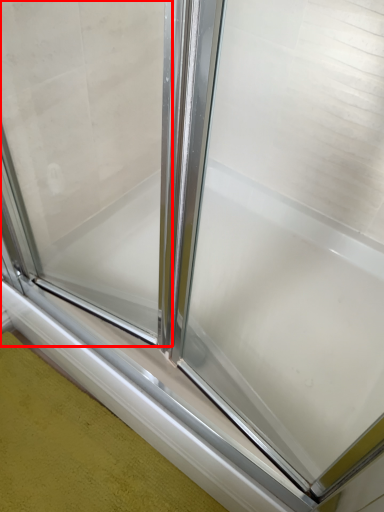
Question: Considering the relative positions of window screen (annotated by the red box) and window sill in the image provided, where is window screen (annotated by the red box) located with respect to the staircase?

Choices:
 (A) left
 (B) right

Answer: (B)